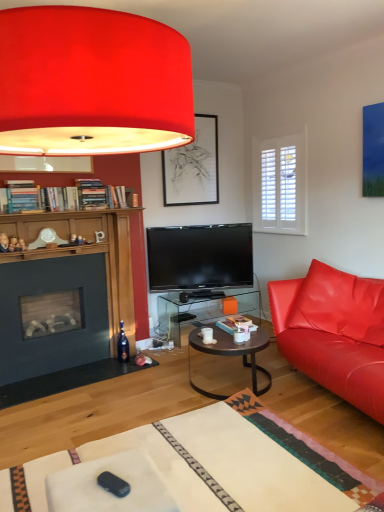
Locate an element on the screen. free space on the front side of black plastic remote control at lower center is located at coordinates click(117, 502).